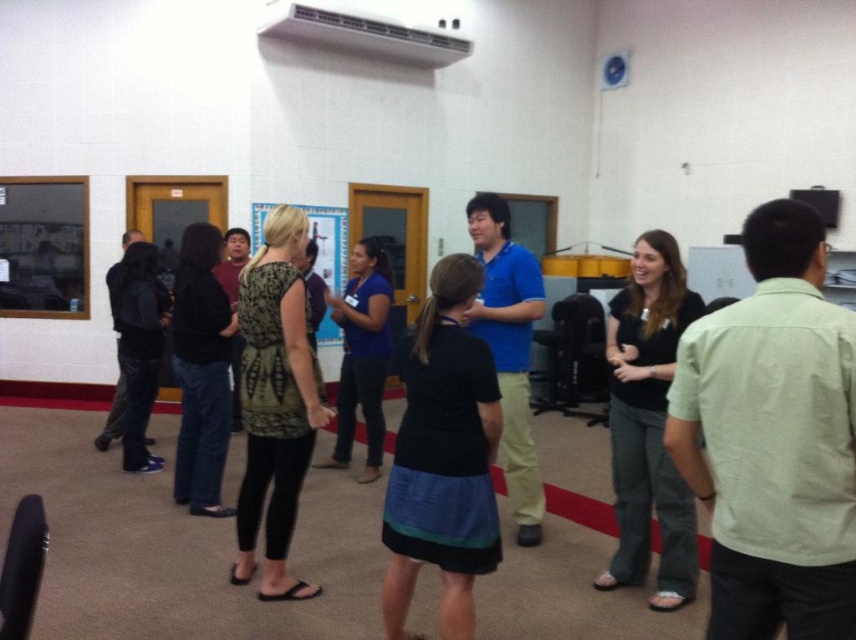
Question: Estimate the real-world distances between objects in this image. Which object is farther from the light green cotton shirt at center?

Choices:
 (A) blue cotton shirt at center
 (B) black matte pants at right

Answer: (A)

Question: Which point appears farthest from the camera in this image?

Choices:
 (A) (679, 269)
 (B) (516, 484)

Answer: (B)

Question: Does light green cotton shirt at center appear over black matte dress at center?

Choices:
 (A) no
 (B) yes

Answer: (B)

Question: Observing the image, what is the correct spatial positioning of light green cotton shirt at center in reference to black matte pants at right?

Choices:
 (A) right
 (B) left

Answer: (B)

Question: Which of the following is the closest to the observer?

Choices:
 (A) (819, 579)
 (B) (458, 538)

Answer: (A)

Question: Is light green cotton shirt at center positioned behind black matte dress at center?

Choices:
 (A) yes
 (B) no

Answer: (B)